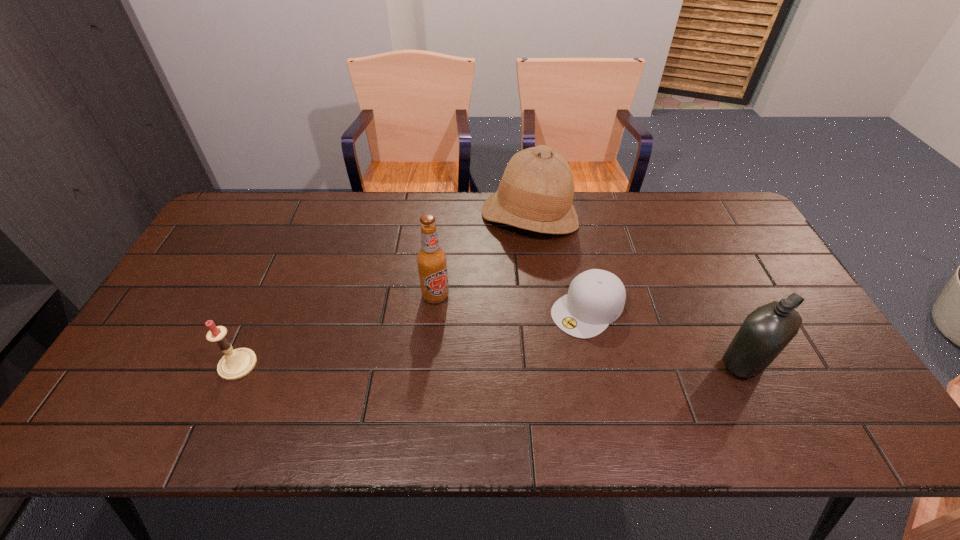
Where is `free space located 0.130m on the front-facing side of the shortest object`? The image size is (960, 540). free space located 0.130m on the front-facing side of the shortest object is located at coordinates (529, 356).

The image size is (960, 540). I want to click on free region located on the front-facing side of the shortest object, so click(523, 361).

Locate an element on the screen. The width and height of the screenshot is (960, 540). vacant space located 0.360m on the front-facing side of the farthest object is located at coordinates (463, 322).

I want to click on vacant position located 0.390m on the front-facing side of the farthest object, so click(x=458, y=330).

Find the location of a particular element. vacant area located on the front-facing side of the farthest object is located at coordinates (466, 316).

Image resolution: width=960 pixels, height=540 pixels. What are the coordinates of `free space located on the front label of the beer bottle` in the screenshot? It's located at (469, 388).

This screenshot has width=960, height=540. What are the coordinates of `vacant space situated 0.050m on the front label of the beer bottle` in the screenshot? It's located at (444, 319).

Locate an element on the screen. Image resolution: width=960 pixels, height=540 pixels. free spot located on the front label of the beer bottle is located at coordinates (449, 333).

Where is `object that is at the far edge`? The image size is (960, 540). object that is at the far edge is located at coordinates (536, 192).

Locate an element on the screen. candle that is at the near edge is located at coordinates (235, 364).